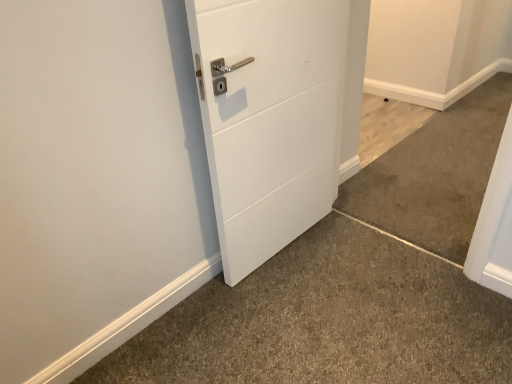
Question: From a real-world perspective, is light brown wood floor at lower right, positioned as the 3th concrete in bottom-to-top order, located higher than white matte door at center?

Choices:
 (A) yes
 (B) no

Answer: (B)

Question: Does light brown wood floor at lower right, positioned as the 3th concrete in bottom-to-top order, lie in front of white matte door at center?

Choices:
 (A) yes
 (B) no

Answer: (B)

Question: Does light brown wood floor at lower right, positioned as the first concrete in top-to-bottom order, have a lesser width compared to white matte door at center?

Choices:
 (A) no
 (B) yes

Answer: (A)

Question: Is light brown wood floor at lower right, positioned as the 3th concrete in bottom-to-top order, at the left side of white matte door at center?

Choices:
 (A) no
 (B) yes

Answer: (A)

Question: Is light brown wood floor at lower right, positioned as the 3th concrete in bottom-to-top order, facing towards white matte door at center?

Choices:
 (A) yes
 (B) no

Answer: (B)

Question: Visually, is white matte door at center positioned to the left or to the right of brown carpet at lower right, which ranks as the second concrete in top-to-bottom order?

Choices:
 (A) left
 (B) right

Answer: (A)

Question: From a real-world perspective, relative to brown carpet at lower right, which appears as the second concrete when ordered from the bottom, is white matte door at center vertically above or below?

Choices:
 (A) below
 (B) above

Answer: (B)

Question: Considering the positions of white matte door at center and brown carpet at lower right, which appears as the second concrete when ordered from the bottom, in the image, is white matte door at center bigger or smaller than brown carpet at lower right, which appears as the second concrete when ordered from the bottom,?

Choices:
 (A) big
 (B) small

Answer: (A)

Question: From the image's perspective, is white matte door at center positioned above or below brown carpet at lower right, which appears as the second concrete when ordered from the bottom?

Choices:
 (A) above
 (B) below

Answer: (B)

Question: Considering the relative positions of gray carpet at lower left, placed as the 1th concrete when sorted from bottom to top, and light brown wood floor at lower right, positioned as the first concrete in top-to-bottom order, in the image provided, is gray carpet at lower left, placed as the 1th concrete when sorted from bottom to top, to the left or to the right of light brown wood floor at lower right, positioned as the first concrete in top-to-bottom order,?

Choices:
 (A) right
 (B) left

Answer: (B)

Question: Considering the positions of gray carpet at lower left, positioned as the third concrete in top-to-bottom order, and light brown wood floor at lower right, positioned as the first concrete in top-to-bottom order, in the image, is gray carpet at lower left, positioned as the third concrete in top-to-bottom order, bigger or smaller than light brown wood floor at lower right, positioned as the first concrete in top-to-bottom order,?

Choices:
 (A) small
 (B) big

Answer: (B)

Question: Looking at their shapes, would you say gray carpet at lower left, positioned as the third concrete in top-to-bottom order, is wider or thinner than light brown wood floor at lower right, positioned as the first concrete in top-to-bottom order?

Choices:
 (A) thin
 (B) wide

Answer: (B)

Question: Which is correct: gray carpet at lower left, positioned as the third concrete in top-to-bottom order, is inside light brown wood floor at lower right, positioned as the 3th concrete in bottom-to-top order, or outside of it?

Choices:
 (A) inside
 (B) outside

Answer: (B)

Question: Is light brown wood floor at lower right, positioned as the first concrete in top-to-bottom order, bigger or smaller than brown carpet at lower right, which appears as the second concrete when ordered from the bottom?

Choices:
 (A) big
 (B) small

Answer: (B)

Question: Is light brown wood floor at lower right, positioned as the first concrete in top-to-bottom order, inside or outside of brown carpet at lower right, which ranks as the second concrete in top-to-bottom order?

Choices:
 (A) inside
 (B) outside

Answer: (B)